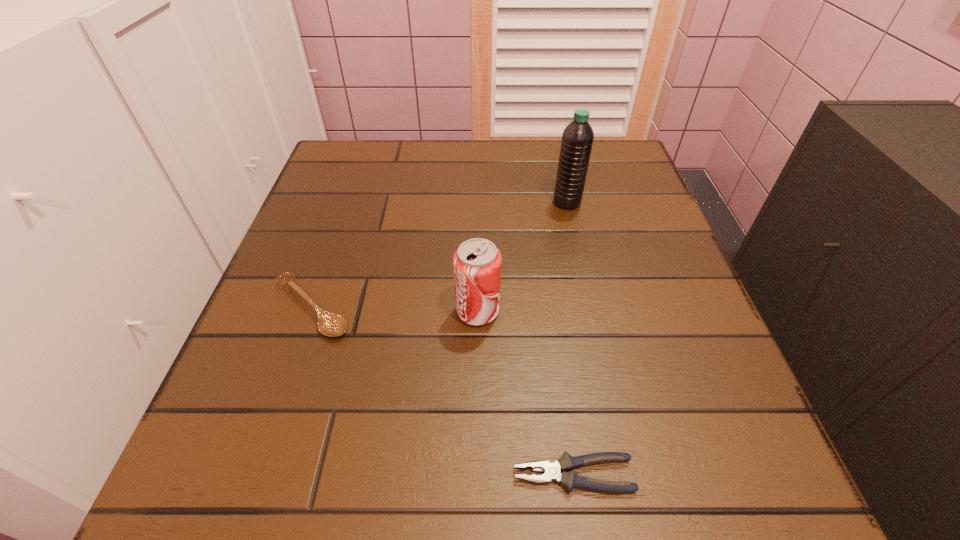
Locate an element on the screen. Image resolution: width=960 pixels, height=540 pixels. water bottle is located at coordinates (577, 139).

Identify the location of the tallest object. (577, 139).

Find the location of a particular element. This screenshot has height=540, width=960. soda can is located at coordinates (477, 262).

Where is `the second tallest object`? Image resolution: width=960 pixels, height=540 pixels. the second tallest object is located at coordinates (477, 262).

Image resolution: width=960 pixels, height=540 pixels. In order to click on ladle in this screenshot , I will do tap(330, 324).

The image size is (960, 540). What are the coordinates of `the leftmost object` in the screenshot? It's located at click(x=330, y=324).

Identify the location of the nearest object. (552, 471).

This screenshot has width=960, height=540. I want to click on pliers, so click(552, 471).

The width and height of the screenshot is (960, 540). Identify the location of free space located 0.340m on the front of the farthest object. (598, 341).

I want to click on vacant space located on the front of the soda can, so click(477, 449).